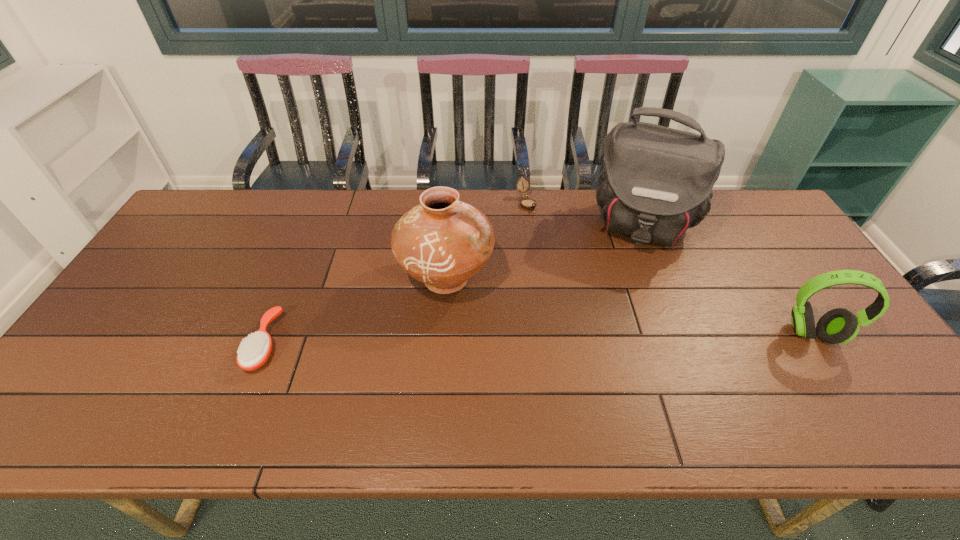
Locate an element on the screen. The width and height of the screenshot is (960, 540). vacant space that's between the compass and the hairbrush is located at coordinates (396, 273).

The height and width of the screenshot is (540, 960). What are the coordinates of `vacant point located between the third tallest object and the second shortest object` in the screenshot? It's located at (669, 269).

In order to click on vacant region between the third object from left to right and the shoulder bag in this screenshot , I will do `click(586, 214)`.

Find the location of a particular element. free spot between the hairbrush and the headset is located at coordinates (539, 339).

Identify the location of vacant area between the rightmost object and the shortest object. The width and height of the screenshot is (960, 540). (539, 339).

This screenshot has width=960, height=540. Identify the location of vacant space that is in between the tallest object and the compass. (586, 214).

Identify the location of free space between the tallest object and the pottery. This screenshot has width=960, height=540. (545, 252).

Locate which object is the closest to the third object from right to left. Please provide its 2D coordinates. Your answer should be formatted as a tuple, i.e. [(x, y)], where the tuple contains the x and y coordinates of a point satisfying the conditions above.

[(656, 182)]

Identify which object is located as the nearest to the hairbrush. Please provide its 2D coordinates. Your answer should be formatted as a tuple, i.e. [(x, y)], where the tuple contains the x and y coordinates of a point satisfying the conditions above.

[(442, 242)]

Identify the location of free spot that satisfies the following two spatial constraints: 1. on the back side of the fourth tallest object; 2. on the left side of the pottery. tap(452, 204).